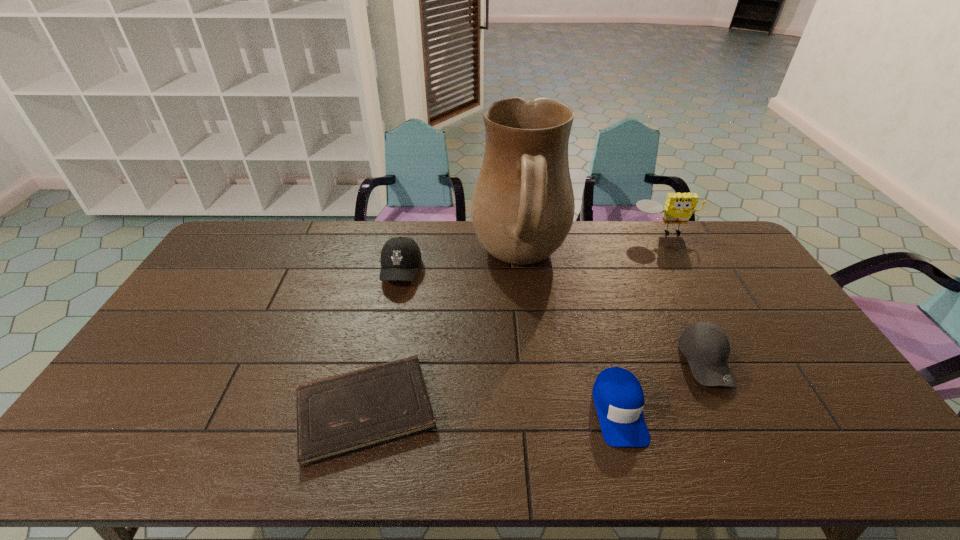
I want to click on vacant area that lies between the shortest object and the cream pitcher, so click(x=443, y=335).

Locate an element on the screen. The image size is (960, 540). vacant space in between the second baseball cap from right to left and the farthest baseball cap is located at coordinates (510, 341).

The width and height of the screenshot is (960, 540). In order to click on vacant area that lies between the leftmost baseball cap and the paperback book in this screenshot , I will do `click(383, 340)`.

This screenshot has height=540, width=960. I want to click on vacant area between the second baseball cap from right to left and the leftmost baseball cap, so click(510, 341).

The width and height of the screenshot is (960, 540). What are the coordinates of `free space between the cream pitcher and the leftmost baseball cap` in the screenshot? It's located at (461, 266).

Identify which object is located as the fifth nearest to the shortest object. Please provide its 2D coordinates. Your answer should be formatted as a tuple, i.e. [(x, y)], where the tuple contains the x and y coordinates of a point satisfying the conditions above.

[(679, 207)]

Choose which object is the nearest neighbor to the rightmost baseball cap. Please provide its 2D coordinates. Your answer should be formatted as a tuple, i.e. [(x, y)], where the tuple contains the x and y coordinates of a point satisfying the conditions above.

[(618, 396)]

Choose which baseball cap is the second nearest neighbor to the leftmost baseball cap. Please provide its 2D coordinates. Your answer should be formatted as a tuple, i.e. [(x, y)], where the tuple contains the x and y coordinates of a point satisfying the conditions above.

[(705, 345)]

The width and height of the screenshot is (960, 540). Identify the location of the second closest baseball cap to the leftmost baseball cap. (705, 345).

Find the location of a particular element. This screenshot has width=960, height=540. free location that satisfies the following two spatial constraints: 1. at the spout of the cream pitcher; 2. on the front-facing side of the leftmost baseball cap is located at coordinates (521, 272).